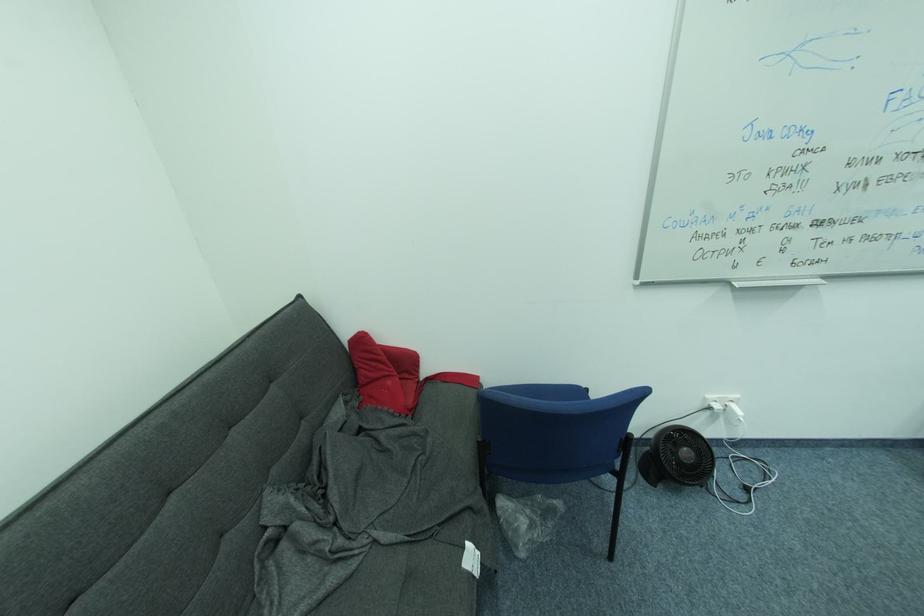
The image size is (924, 616). In order to click on black portable fan in this screenshot , I will do `click(677, 456)`.